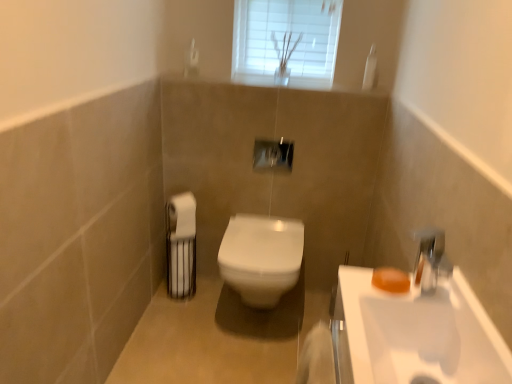
Image resolution: width=512 pixels, height=384 pixels. I want to click on vacant space situated above white glossy toilet at center (from a real-world perspective), so click(260, 229).